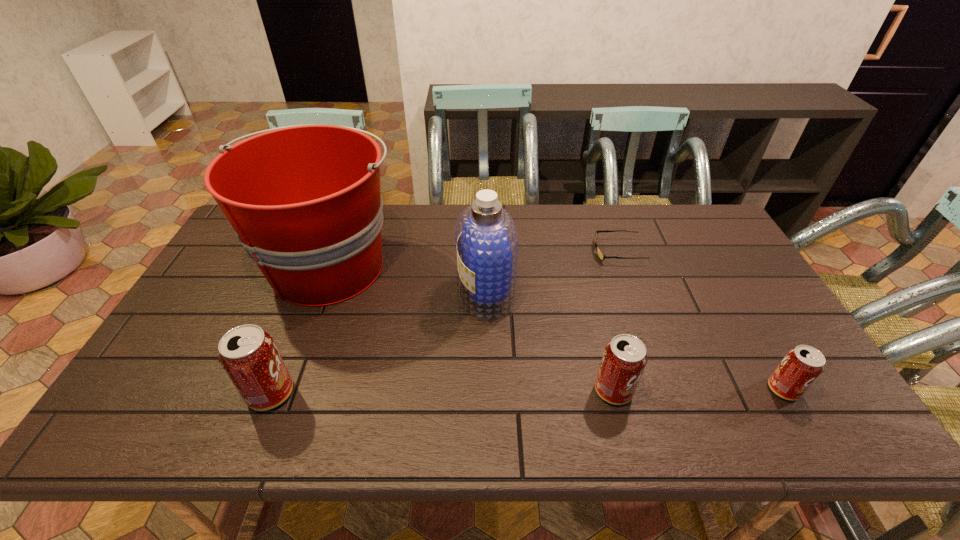
At what (x,y) coordinates should I click in order to perform the action: click on empty location between the third tallest object and the third object from left to right. Please return your answer as a coordinate pair (x, y). Image resolution: width=960 pixels, height=540 pixels. Looking at the image, I should click on (378, 343).

This screenshot has height=540, width=960. Find the location of `vacant space in between the leftmost soda can and the rightmost object`. vacant space in between the leftmost soda can and the rightmost object is located at coordinates (527, 391).

I want to click on vacant area that lies between the sunglasses and the rightmost soda can, so click(701, 320).

At what (x,y) coordinates should I click in order to perform the action: click on free point between the bucket and the leftmost soda can. Please return your answer as a coordinate pair (x, y). Looking at the image, I should click on (300, 329).

Identify the location of free space between the third shortest object and the rightmost soda can. (698, 390).

Find the location of a particular element. unoccupied area between the cleansing agent and the tallest soda can is located at coordinates pyautogui.click(x=378, y=343).

Identify the location of object that is the fifth closest to the shortest object. click(x=248, y=354).

Locate an element on the screen. Image resolution: width=960 pixels, height=540 pixels. object that can be found as the closest to the rightmost object is located at coordinates (624, 359).

I want to click on the closest soda can to the third tallest object, so click(624, 359).

Image resolution: width=960 pixels, height=540 pixels. I want to click on soda can that can be found as the closest to the shortest object, so click(x=624, y=359).